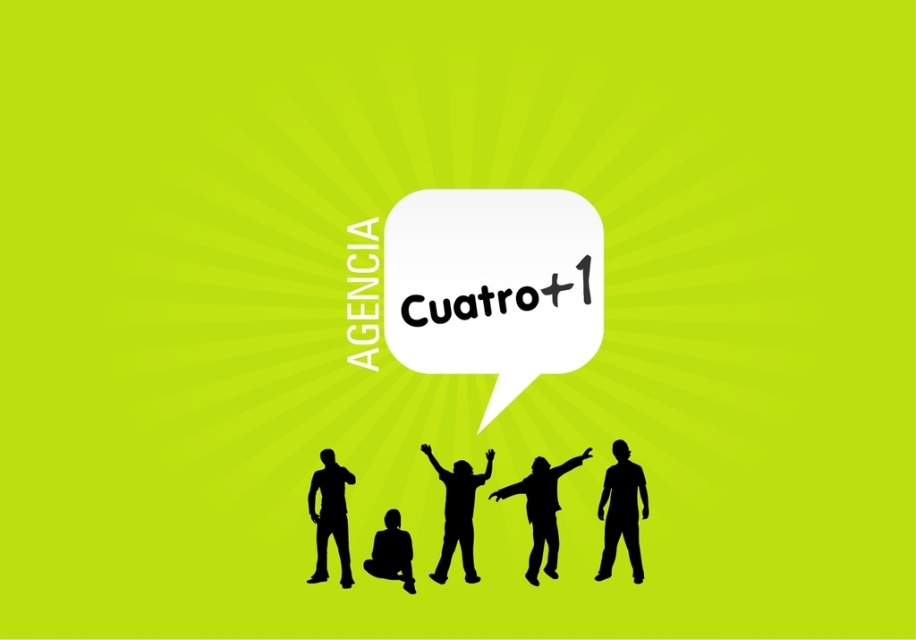
You are designing a poster and need to ensure that the yellow text at upper center is visible against the black matte figure at lower center. Based on the scene description, is the yellow text likely to be readable?

The yellow text at upper center is positioned over the black matte figure at lower center. Since yellow and black are contrasting colors, the text should be clearly readable against the figure.

You are designing a poster and need to ensure that the spacing between the black silhouette figure at lower right and the black silhouette at lower left is sufficient for readability. Given that the minimum required spacing between elements in your design is 10 inches, does the current spacing meet this requirement?

The black silhouette figure at lower right is 10.42 inches away from the black silhouette at lower left, which exceeds the minimum required spacing of 10 inches. Therefore, the current spacing meets the requirement.